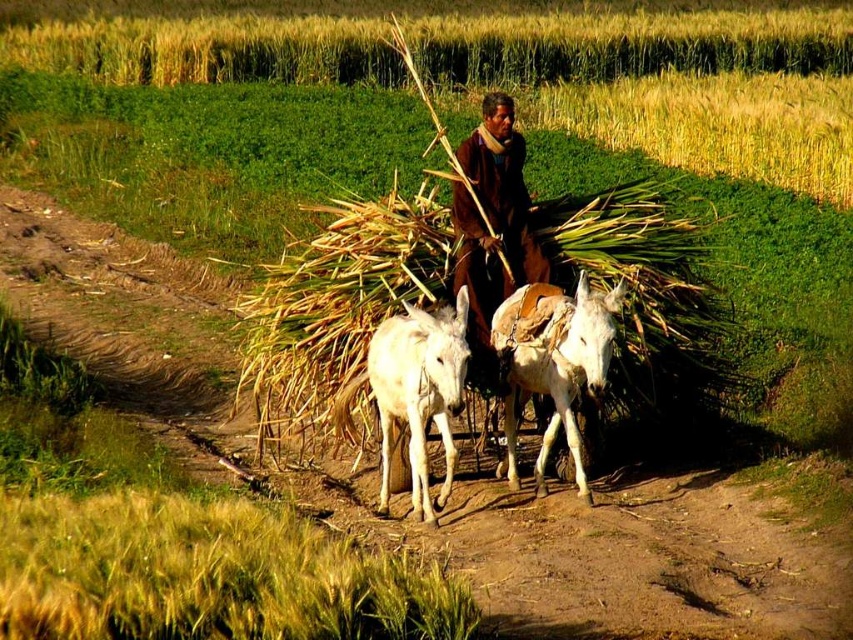
You are a farmer who needs to choose the stronger donkey to pull a heavy load. Based on the image, which donkey should you select between the white leather donkey at center and the white smooth donkey at center?

The white leather donkey at center is larger in size than the white smooth donkey at center, so the white leather donkey at center is stronger and better suited for pulling heavy loads.